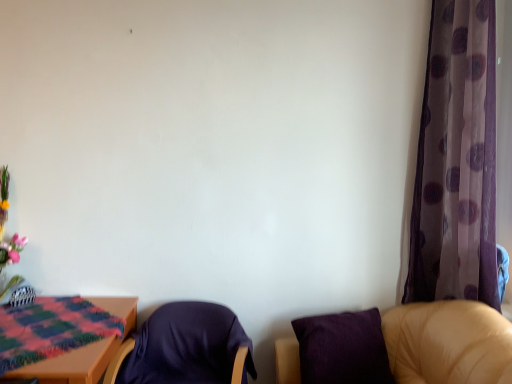
Question: Is transparent purple curtain at right spatially inside purple fabric chair at lower right, the second chair viewed from the left, or outside of it?

Choices:
 (A) outside
 (B) inside

Answer: (A)

Question: From a real-world perspective, is transparent purple curtain at right positioned above or below purple fabric chair at lower right, the second chair viewed from the left?

Choices:
 (A) below
 (B) above

Answer: (B)

Question: Which object is the farthest from the wooden table at lower left?

Choices:
 (A) transparent purple curtain at right
 (B) matte ceramic vase at left
 (C) purple fabric chair at lower right, the 1th chair from the right
 (D) dark blue fabric chair at center, marked as the 1th chair in a left-to-right arrangement

Answer: (A)

Question: Based on their relative distances, which object is nearer to the wooden table at lower left?

Choices:
 (A) dark blue fabric chair at center, which appears as the 2th chair when viewed from the right
 (B) transparent purple curtain at right
 (C) matte ceramic vase at left
 (D) purple fabric chair at lower right, the second chair viewed from the left

Answer: (A)